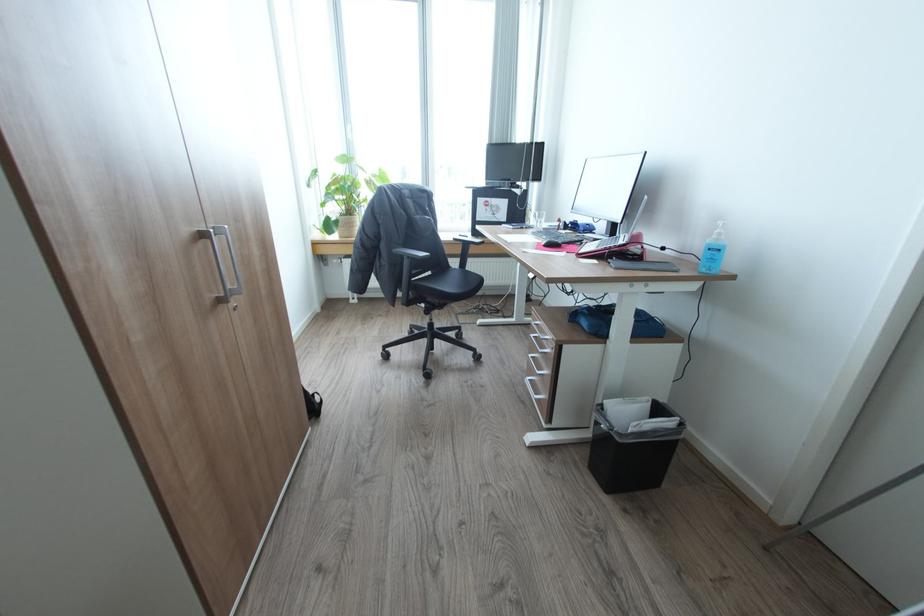
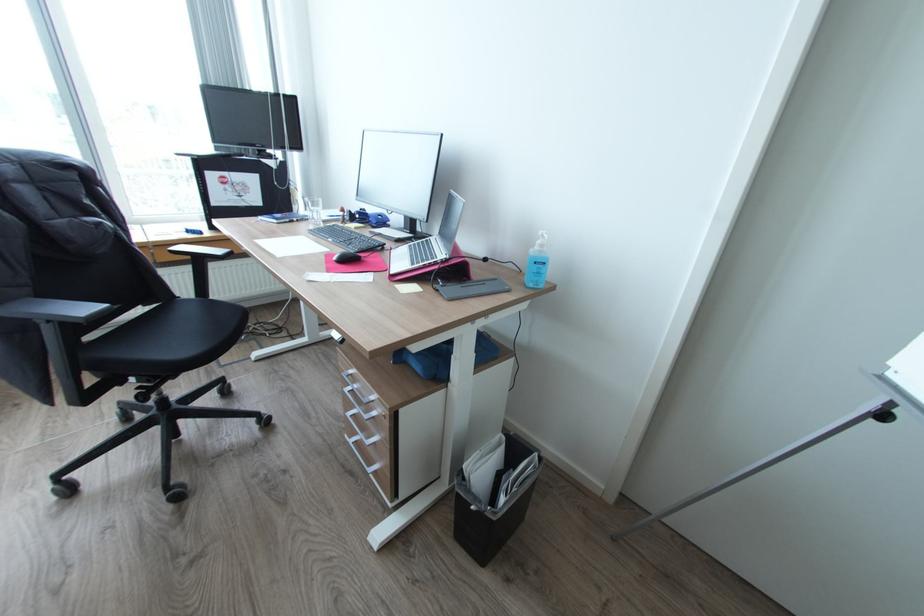
Locate, in the second image, the point that corresponds to (x=575, y=225) in the first image.

(362, 216)